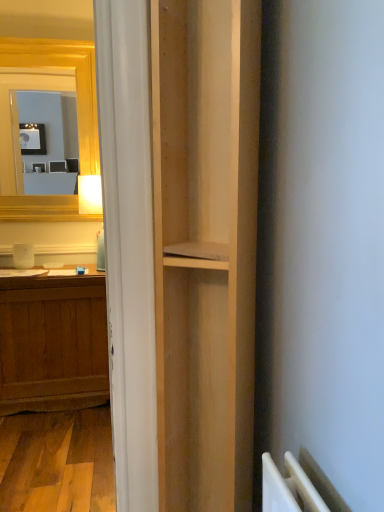
Question: Is wooden desk at left at the back of natural wood bookshelf at center?

Choices:
 (A) yes
 (B) no

Answer: (B)

Question: Does natural wood bookshelf at center touch wooden desk at left?

Choices:
 (A) yes
 (B) no

Answer: (B)

Question: Is natural wood bookshelf at center bigger than wooden desk at left?

Choices:
 (A) yes
 (B) no

Answer: (A)

Question: Is natural wood bookshelf at center thinner than wooden desk at left?

Choices:
 (A) no
 (B) yes

Answer: (A)

Question: From the image's perspective, is natural wood bookshelf at center on top of wooden desk at left?

Choices:
 (A) yes
 (B) no

Answer: (A)

Question: Is natural wood bookshelf at center smaller than wooden desk at left?

Choices:
 (A) yes
 (B) no

Answer: (B)

Question: From the image's perspective, is wooden desk at left under natural wood bookshelf at center?

Choices:
 (A) no
 (B) yes

Answer: (B)

Question: Does wooden desk at left appear on the left side of natural wood bookshelf at center?

Choices:
 (A) yes
 (B) no

Answer: (A)

Question: Is wooden desk at left facing towards natural wood bookshelf at center?

Choices:
 (A) yes
 (B) no

Answer: (B)

Question: Considering the relative sizes of wooden desk at left and natural wood bookshelf at center in the image provided, is wooden desk at left wider than natural wood bookshelf at center?

Choices:
 (A) no
 (B) yes

Answer: (A)

Question: Can you confirm if wooden desk at left is smaller than natural wood bookshelf at center?

Choices:
 (A) yes
 (B) no

Answer: (A)

Question: Is natural wood bookshelf at center surrounded by wooden desk at left?

Choices:
 (A) yes
 (B) no

Answer: (B)

Question: In terms of size, does wooden desk at left appear bigger or smaller than natural wood bookshelf at center?

Choices:
 (A) big
 (B) small

Answer: (B)